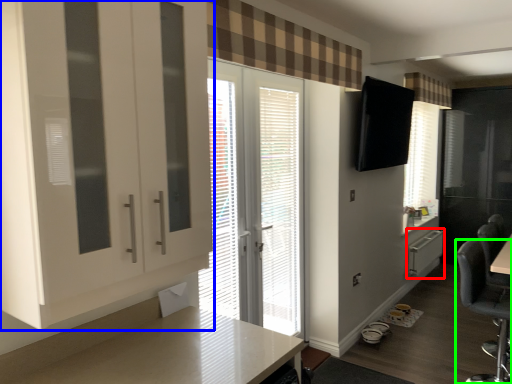
Question: Estimate the real-world distances between objects in this image. Which object is closer to file cabinet (highlighted by a red box), cabinetry (highlighted by a blue box) or chair (highlighted by a green box)?

Choices:
 (A) cabinetry
 (B) chair

Answer: (B)